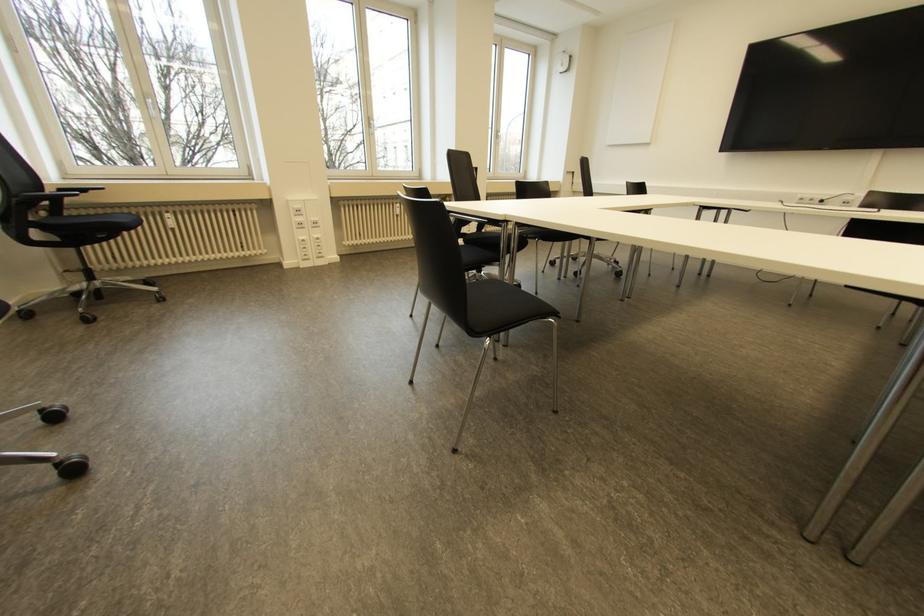
Image resolution: width=924 pixels, height=616 pixels. In order to click on chair armrest in this screenshot , I will do `click(43, 197)`.